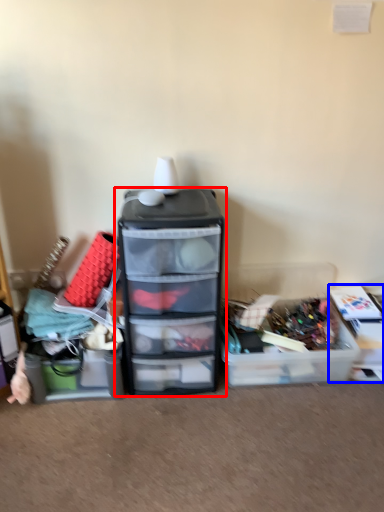
Question: Which object appears farthest to the camera in this image, furniture (highlighted by a red box) or storage box (highlighted by a blue box)?

Choices:
 (A) furniture
 (B) storage box

Answer: (B)